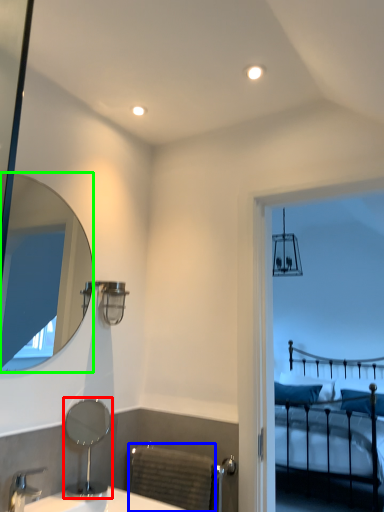
Question: Based on their relative distances, which object is nearer to mirror (highlighted by a red box)? Choose from radiator (highlighted by a blue box) and mirror (highlighted by a green box).

Choices:
 (A) radiator
 (B) mirror

Answer: (A)